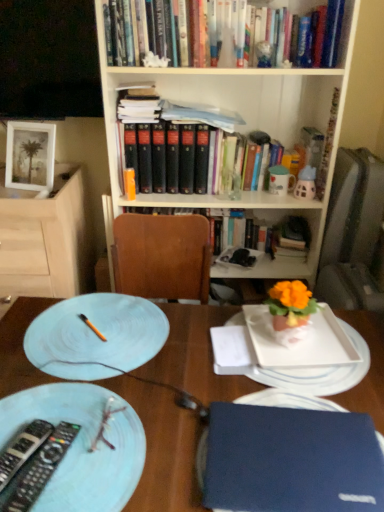
Image resolution: width=384 pixels, height=512 pixels. I want to click on empty space that is ontop of white glossy platter at center (from a real-world perspective), so click(297, 348).